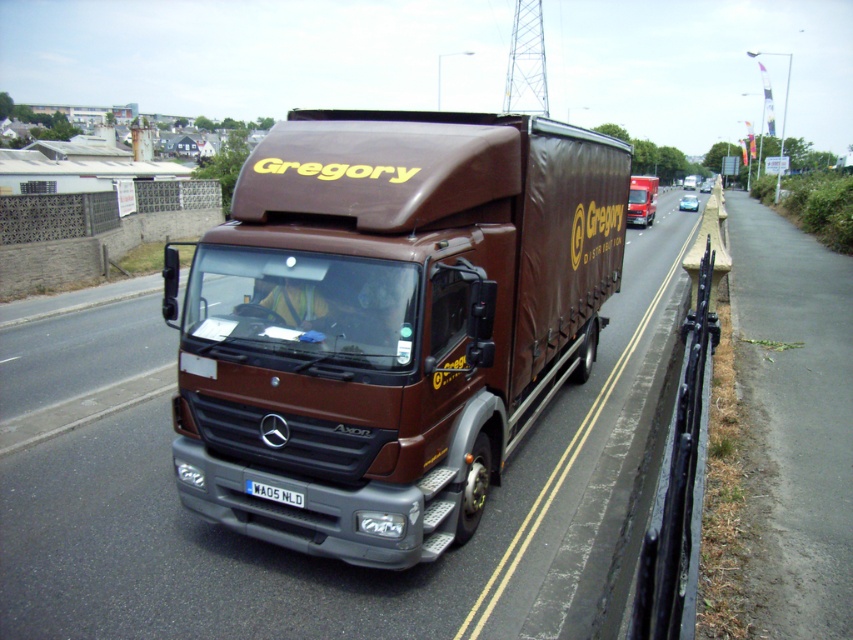
Question: Is brown matte trailer truck at center wider than white plastic license plate at center?

Choices:
 (A) no
 (B) yes

Answer: (A)

Question: Considering the real-world distances, which object is closest to the brown matte truck at center?

Choices:
 (A) brown matte trailer truck at center
 (B) white plastic license plate at center

Answer: (B)

Question: Is brown matte truck at center above white plastic license plate at center?

Choices:
 (A) yes
 (B) no

Answer: (A)

Question: Which point appears closest to the camera in this image?

Choices:
 (A) (199, 451)
 (B) (262, 493)
 (C) (631, 198)

Answer: (B)

Question: Can you confirm if brown matte trailer truck at center is positioned above white plastic license plate at center?

Choices:
 (A) yes
 (B) no

Answer: (A)

Question: Which is farther from the white plastic license plate at center?

Choices:
 (A) brown matte trailer truck at center
 (B) brown matte truck at center

Answer: (B)